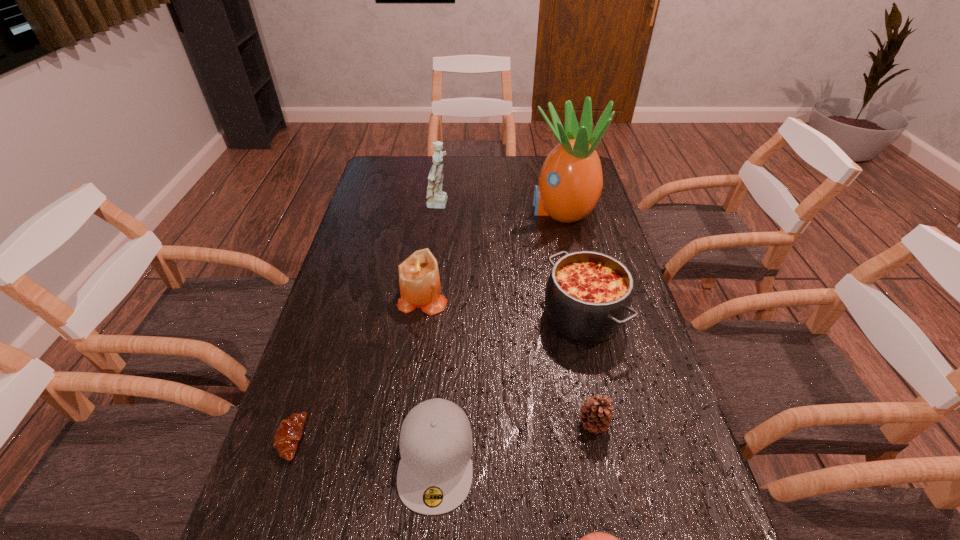
Identify the location of blank space at the far edge of the desktop. This screenshot has width=960, height=540. (489, 166).

Identify the location of vacant space at the left edge. The height and width of the screenshot is (540, 960). (364, 321).

The height and width of the screenshot is (540, 960). Find the location of `unoccupied area between the casserole and the cap`. unoccupied area between the casserole and the cap is located at coordinates (510, 387).

Image resolution: width=960 pixels, height=540 pixels. What are the coordinates of `free spot between the candle and the figurine` in the screenshot? It's located at (431, 252).

You are a GUI agent. You are given a task and a screenshot of the screen. Output one action in this format:
    pyautogui.click(x=<x>, y=<y>)
    Task: Click on the vacant area that lies between the pinecone and the casserole
    
    Given the screenshot: What is the action you would take?
    pyautogui.click(x=588, y=370)

The image size is (960, 540). In order to click on free area in between the candle and the pinecone in this screenshot , I will do `click(508, 360)`.

Where is `free spot between the candle and the cap`? The height and width of the screenshot is (540, 960). free spot between the candle and the cap is located at coordinates (429, 377).

Identify the location of free spot between the casserole and the candle. (503, 307).

At what (x,y) coordinates should I click in order to perform the action: click on object that stands as the fifth closest to the candle. Please return your answer as a coordinate pair (x, y). This screenshot has width=960, height=540. Looking at the image, I should click on (570, 183).

I want to click on object that stands as the second closest to the shortest object, so click(x=419, y=281).